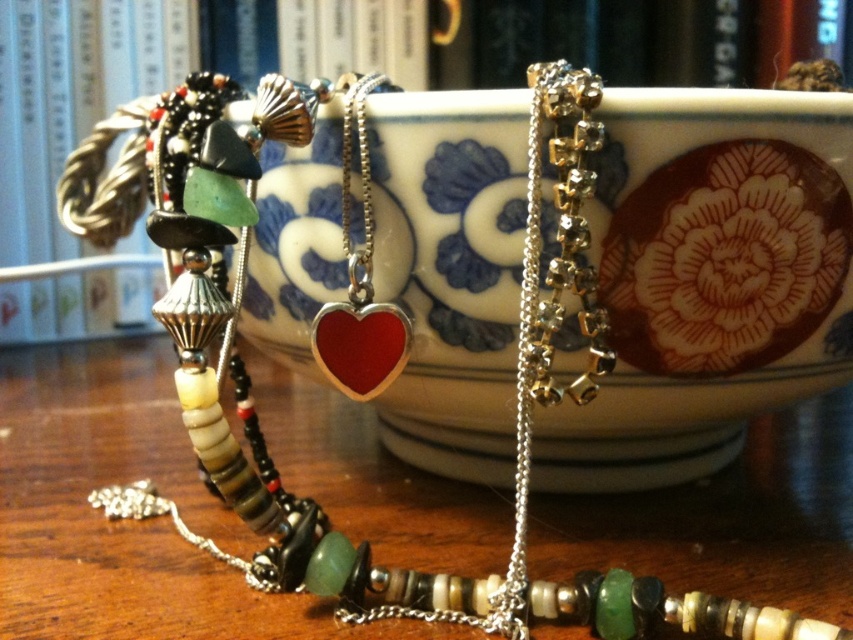
Question: Which point is closer to the camera?

Choices:
 (A) (242, 35)
 (B) (332, 353)

Answer: (B)

Question: Which object appears closest to the camera in this image?

Choices:
 (A) matte white bookshelf at upper center
 (B) shiny red heart at center

Answer: (B)

Question: Can you confirm if matte white bookshelf at upper center is bigger than shiny red heart at center?

Choices:
 (A) yes
 (B) no

Answer: (A)

Question: Can you confirm if matte white bookshelf at upper center is positioned below shiny red heart at center?

Choices:
 (A) no
 (B) yes

Answer: (A)

Question: Which point is closer to the camera?

Choices:
 (A) matte white bookshelf at upper center
 (B) shiny red heart at center

Answer: (B)

Question: Does matte white bookshelf at upper center appear on the right side of shiny red heart at center?

Choices:
 (A) yes
 (B) no

Answer: (B)